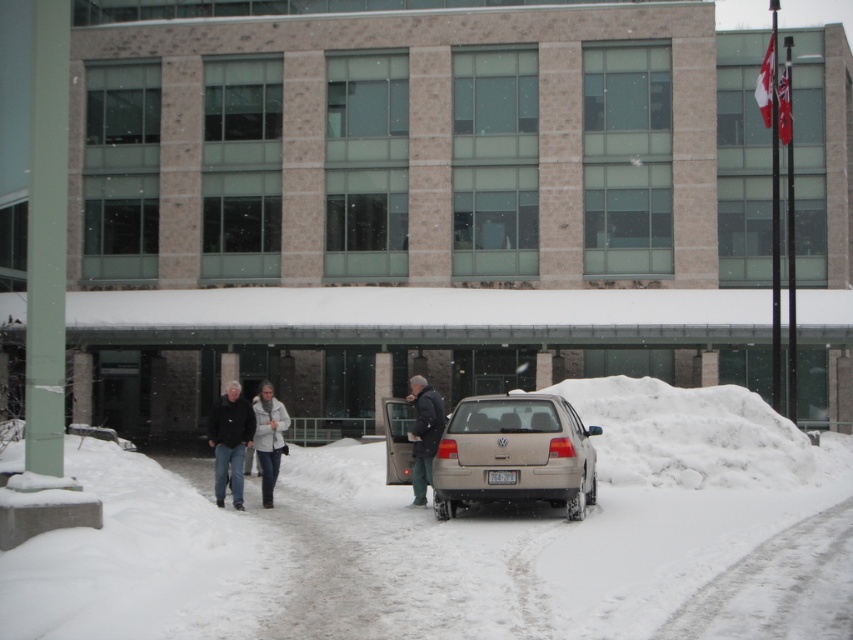
Does white fluffy snow at center have a larger size compared to dark blue jacket at center?

Correct, white fluffy snow at center is larger in size than dark blue jacket at center.

Which is behind, point (334, 577) or point (426, 397)?

The point (426, 397) is behind.

Who is more distant from viewer, [757,544] or [431,458]?

Positioned behind is point [431,458].

Image resolution: width=853 pixels, height=640 pixels. I want to click on white fluffy snow at center, so click(x=428, y=536).

How distant is dark blue jeans at center from white fleece jacket at center?

dark blue jeans at center and white fleece jacket at center are 8.89 feet apart.

Is dark blue jeans at center to the left of white fleece jacket at center from the viewer's perspective?

In fact, dark blue jeans at center is to the right of white fleece jacket at center.

Is point (229, 422) positioned behind point (270, 502)?

No, it is not.

The height and width of the screenshot is (640, 853). Find the location of `dark blue jeans at center`. dark blue jeans at center is located at coordinates (230, 442).

Is point (496, 397) positioned in front of point (419, 444)?

Yes, point (496, 397) is in front of point (419, 444).

Which is more to the left, satin beige sedan at center or dark blue jacket at center?

From the viewer's perspective, dark blue jacket at center appears more on the left side.

Between point (529, 406) and point (409, 394), which one is positioned in front?

Point (529, 406) is in front.

The width and height of the screenshot is (853, 640). What are the coordinates of `satin beige sedan at center` in the screenshot? It's located at (514, 454).